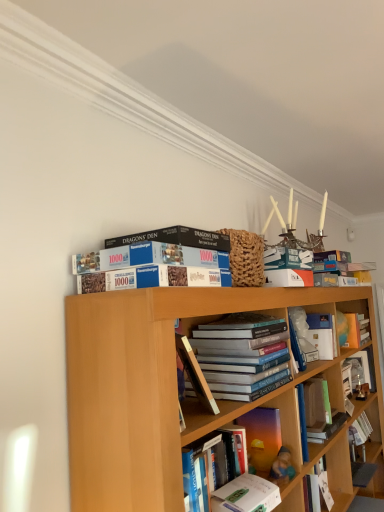
Image resolution: width=384 pixels, height=512 pixels. Describe the element at coordinates (317, 490) in the screenshot. I see `white glossy book at upper center, which is the 5th book from front to back` at that location.

Locate an element on the screen. hardcover books at center, arranged as the seventh book when viewed from the back is located at coordinates (242, 355).

I want to click on white matte book at center, arranged as the 8th book when viewed from the back, so pyautogui.click(x=246, y=495).

What do you see at coordinates (176, 238) in the screenshot?
I see `matte black puzzle box at upper center, the 1th book when ordered from front to back` at bounding box center [176, 238].

The height and width of the screenshot is (512, 384). Describe the element at coordinates (359, 434) in the screenshot. I see `hardcover book at center, which appears as the seventh book when viewed from the front` at that location.

I want to click on white glossy book at center, which is counted as the fourth book, starting from the back, so click(x=315, y=331).

Locate an element on the screen. This screenshot has height=512, width=384. paperback book above the hardcover books at center, the third book in the front-to-back sequence (from the image's perspective) is located at coordinates (x=195, y=374).

Is hardcover book at center at the back of hardcover books at center, arranged as the seventh book when viewed from the back?

No, hardcover books at center, arranged as the seventh book when viewed from the back, is not facing away from hardcover book at center.

Is hardcover books at center, the third book in the front-to-back sequence, far away from hardcover book at center?

hardcover books at center, the third book in the front-to-back sequence, is actually quite close to hardcover book at center.

Is hardcover books at center, the third book in the front-to-back sequence, further to the viewer compared to hardcover book at center?

Yes, hardcover books at center, the third book in the front-to-back sequence, is further from the camera.

Is matte black puzzle box at upper center, the 1th book when ordered from front to back, looking in the opposite direction of orange matte bookshelf at upper center, which appears as the 2th book when viewed from the back?

matte black puzzle box at upper center, the 1th book when ordered from front to back, does not have its back to orange matte bookshelf at upper center, which appears as the 2th book when viewed from the back.

Does matte black puzzle box at upper center, which ranks as the 9th book in back-to-front order, touch orange matte bookshelf at upper center, the eighth book in the front-to-back sequence?

No, matte black puzzle box at upper center, which ranks as the 9th book in back-to-front order, is not touching orange matte bookshelf at upper center, the eighth book in the front-to-back sequence.

From a real-world perspective, which is physically below, matte black puzzle box at upper center, which ranks as the 9th book in back-to-front order, or orange matte bookshelf at upper center, the eighth book in the front-to-back sequence?

In real-world perspective, orange matte bookshelf at upper center, the eighth book in the front-to-back sequence, is lower.

Is orange matte bookshelf at upper center, which appears as the 2th book when viewed from the back, surrounded by matte black puzzle box at upper center, the 1th book when ordered from front to back?

That's incorrect, orange matte bookshelf at upper center, which appears as the 2th book when viewed from the back, is not inside matte black puzzle box at upper center, the 1th book when ordered from front to back.

This screenshot has height=512, width=384. In order to click on book that is the 1st one when counting backward from the white glossy book at center, which is counted as the fourth book, starting from the back in this screenshot , I will do `click(359, 434)`.

Is there a large distance between hardcover book at center, which appears as the seventh book when viewed from the front, and white glossy book at center, which is counted as the fourth book, starting from the back?

No, hardcover book at center, which appears as the seventh book when viewed from the front, is not far from white glossy book at center, which is counted as the fourth book, starting from the back.

Considering the sizes of objects hardcover book at center, marked as the third book in a back-to-front arrangement, and white glossy book at center, the sixth book from the front, in the image provided, who is thinner, hardcover book at center, marked as the third book in a back-to-front arrangement, or white glossy book at center, the sixth book from the front,?

Thinner between the two is hardcover book at center, marked as the third book in a back-to-front arrangement.

Does hardcover book at center, marked as the third book in a back-to-front arrangement, turn towards white glossy book at center, the sixth book from the front?

No, hardcover book at center, marked as the third book in a back-to-front arrangement, does not turn towards white glossy book at center, the sixth book from the front.

Is there a large distance between orange matte bookshelf at upper center, the eighth book in the front-to-back sequence, and white glossy book at center, the sixth book from the front?

orange matte bookshelf at upper center, the eighth book in the front-to-back sequence, is actually quite close to white glossy book at center, the sixth book from the front.

Relative to white glossy book at center, the sixth book from the front, is orange matte bookshelf at upper center, which appears as the 2th book when viewed from the back, in front or behind?

orange matte bookshelf at upper center, which appears as the 2th book when viewed from the back, is behind white glossy book at center, the sixth book from the front.

Starting from the white glossy book at center, which is counted as the fourth book, starting from the back, which book is the 2nd one behind? Please provide its 2D coordinates.

[(353, 329)]

Based on their positions, is orange matte bookshelf at upper center, the eighth book in the front-to-back sequence, located to the left or right of white glossy book at center, the sixth book from the front?

orange matte bookshelf at upper center, the eighth book in the front-to-back sequence, is positioned on white glossy book at center, the sixth book from the front,'s right side.

Which is behind, white matte book at center, the second book when ordered from front to back, or wooden photo frame at right, which is the first book from back to front?

wooden photo frame at right, which is the first book from back to front, is further away from the camera.

Looking at the image, does white matte book at center, the second book when ordered from front to back, seem bigger or smaller compared to wooden photo frame at right, which is the first book from back to front?

white matte book at center, the second book when ordered from front to back, is smaller than wooden photo frame at right, which is the first book from back to front.

From the image's perspective, which one is positioned higher, white matte book at center, arranged as the 8th book when viewed from the back, or wooden photo frame at right, which is the first book from back to front?

wooden photo frame at right, which is the first book from back to front, appears higher in the image.

From the picture: Is white matte book at center, the second book when ordered from front to back, turned away from wooden photo frame at right, which is the first book from back to front?

No.

In the image, is hardcover book at center on the left side or the right side of hardcover books at center, arranged as the seventh book when viewed from the back?

From the image, it's evident that hardcover book at center is to the left of hardcover books at center, arranged as the seventh book when viewed from the back.

Considering their positions, is hardcover book at center located in front of or behind hardcover books at center, arranged as the seventh book when viewed from the back?

hardcover book at center is in front of hardcover books at center, arranged as the seventh book when viewed from the back.

How far apart are hardcover book at center and hardcover books at center, arranged as the seventh book when viewed from the back?

hardcover book at center is 8.12 inches from hardcover books at center, arranged as the seventh book when viewed from the back.

From a real-world perspective, which object stands above the other?

translucent plastic book at center, the sixth book in the back-to-front sequence, from a real-world perspective.

Would you consider hardcover book at center, marked as the third book in a back-to-front arrangement, to be distant from translucent plastic book at center, which is counted as the 4th book, starting from the front?

Absolutely, hardcover book at center, marked as the third book in a back-to-front arrangement, is distant from translucent plastic book at center, which is counted as the 4th book, starting from the front.

From the picture: Considering the relative positions of hardcover book at center, which appears as the seventh book when viewed from the front, and translucent plastic book at center, which is counted as the 4th book, starting from the front, in the image provided, is hardcover book at center, which appears as the seventh book when viewed from the front, to the left of translucent plastic book at center, which is counted as the 4th book, starting from the front, from the viewer's perspective?

Incorrect, hardcover book at center, which appears as the seventh book when viewed from the front, is not on the left side of translucent plastic book at center, which is counted as the 4th book, starting from the front.

Find the location of `paperback book lying above the hardcover books at center, the third book in the front-to-back sequence (from the image's perspective)`. paperback book lying above the hardcover books at center, the third book in the front-to-back sequence (from the image's perspective) is located at coordinates (195, 374).

From a real-world perspective, which book is the 3rd one above the orange matte bookshelf at upper center, the eighth book in the front-to-back sequence? Please provide its 2D coordinates.

[(176, 238)]

From the image, which object appears to be farther from hardcover book at center, hardcover books at center, the third book in the front-to-back sequence, or white matte book at center, arranged as the 8th book when viewed from the back?

Among the two, white matte book at center, arranged as the 8th book when viewed from the back, is located further to hardcover book at center.

Considering their positions, is translucent plastic book at center, the sixth book in the back-to-front sequence, positioned closer to hardcover book at center than hardcover book at center, marked as the third book in a back-to-front arrangement?

translucent plastic book at center, the sixth book in the back-to-front sequence, is closer to hardcover book at center.

From the image, which object appears to be farther from translucent plastic book at center, the sixth book in the back-to-front sequence, orange matte bookshelf at upper center, the eighth book in the front-to-back sequence, or matte black puzzle box at upper center, the 1th book when ordered from front to back?

orange matte bookshelf at upper center, the eighth book in the front-to-back sequence, lies further to translucent plastic book at center, the sixth book in the back-to-front sequence, than the other object.

Which object lies nearer to the anchor point white matte book at center, arranged as the 8th book when viewed from the back, translucent plastic book at center, the sixth book in the back-to-front sequence, or hardcover books at center, arranged as the seventh book when viewed from the back?

translucent plastic book at center, the sixth book in the back-to-front sequence, is positioned closer to the anchor white matte book at center, arranged as the 8th book when viewed from the back.

In the scene shown: From the image, which object appears to be farther from orange matte bookshelf at upper center, which appears as the 2th book when viewed from the back, white glossy book at upper center, the 5th book positioned from the back, or translucent plastic book at center, the sixth book in the back-to-front sequence?

Among the two, translucent plastic book at center, the sixth book in the back-to-front sequence, is located further to orange matte bookshelf at upper center, which appears as the 2th book when viewed from the back.

Which object lies further to the anchor point matte black puzzle box at upper center, the 1th book when ordered from front to back, translucent plastic book at center, which is counted as the 4th book, starting from the front, or white glossy book at upper center, which is the 5th book from front to back?

white glossy book at upper center, which is the 5th book from front to back.

When comparing their distances from translucent plastic book at center, which is counted as the 4th book, starting from the front, does white matte book at center, the second book when ordered from front to back, or hardcover books at center, arranged as the seventh book when viewed from the back, seem closer?

Among the two, white matte book at center, the second book when ordered from front to back, is located nearer to translucent plastic book at center, which is counted as the 4th book, starting from the front.

Looking at the image, which one is located closer to white matte book at center, the second book when ordered from front to back, matte black puzzle box at upper center, which ranks as the 9th book in back-to-front order, or hardcover book at center?

The object closer to white matte book at center, the second book when ordered from front to back, is hardcover book at center.

Locate an element on the screen. This screenshot has height=512, width=384. paperback book positioned between matte black puzzle box at upper center, which ranks as the 9th book in back-to-front order, and white glossy book at center, the sixth book from the front, from near to far is located at coordinates (195, 374).

Locate an element on the screen. The width and height of the screenshot is (384, 512). paperback book located between matte black puzzle box at upper center, which ranks as the 9th book in back-to-front order, and hardcover book at center, marked as the third book in a back-to-front arrangement, in the depth direction is located at coordinates (195, 374).

Image resolution: width=384 pixels, height=512 pixels. What are the coordinates of `paperback book between matte black puzzle box at upper center, which ranks as the 9th book in back-to-front order, and orange matte bookshelf at upper center, the eighth book in the front-to-back sequence, along the z-axis` in the screenshot? It's located at (195, 374).

This screenshot has height=512, width=384. Find the location of `paperback book between matte black puzzle box at upper center, the 1th book when ordered from front to back, and wooden photo frame at right, which is the first book from back to front, along the z-axis`. paperback book between matte black puzzle box at upper center, the 1th book when ordered from front to back, and wooden photo frame at right, which is the first book from back to front, along the z-axis is located at coordinates (195, 374).